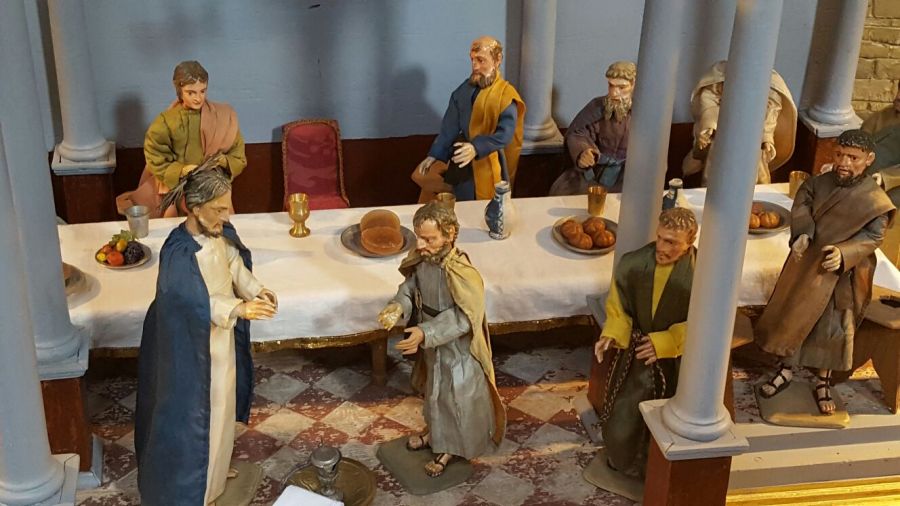
At what (x,y) coordinates should I click in order to perform the action: click on pillars. Please return your answer as a coordinate pair (x, y). This screenshot has height=506, width=900. Looking at the image, I should click on [x=37, y=400], [x=68, y=337], [x=88, y=154], [x=537, y=36], [x=646, y=63], [x=731, y=100], [x=840, y=80].